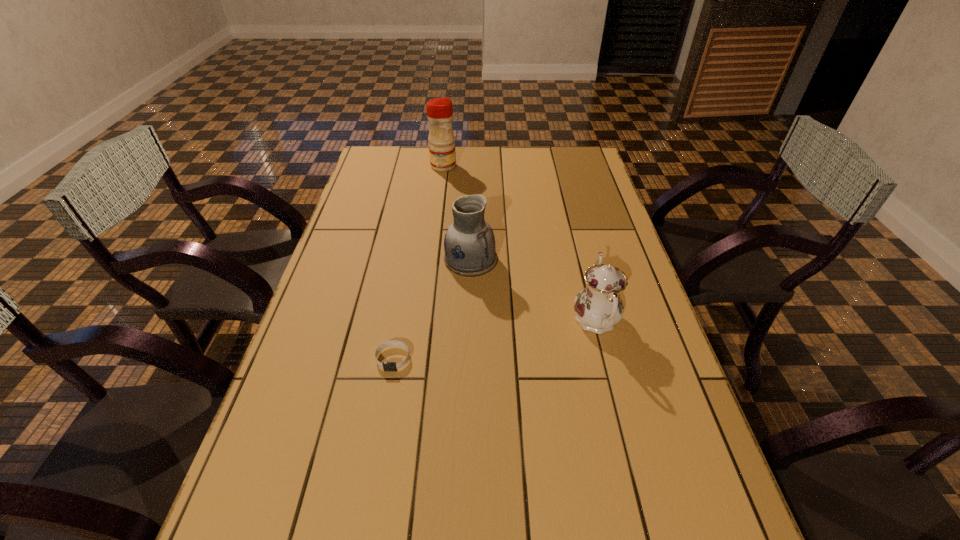
Identify the location of vacant area between the farthest object and the chinaware. (519, 244).

Image resolution: width=960 pixels, height=540 pixels. I want to click on free space between the tallest object and the rightmost object, so pyautogui.click(x=519, y=244).

At what (x,y) coordinates should I click in order to perform the action: click on free space between the tallest object and the chinaware. Please return your answer as a coordinate pair (x, y). This screenshot has height=540, width=960. Looking at the image, I should click on (519, 244).

I want to click on object that stands as the second closest to the tallest object, so click(598, 307).

Identify which object is the nearest to the wristband. Please provide its 2D coordinates. Your answer should be formatted as a tuple, i.e. [(x, y)], where the tuple contains the x and y coordinates of a point satisfying the conditions above.

[(469, 244)]